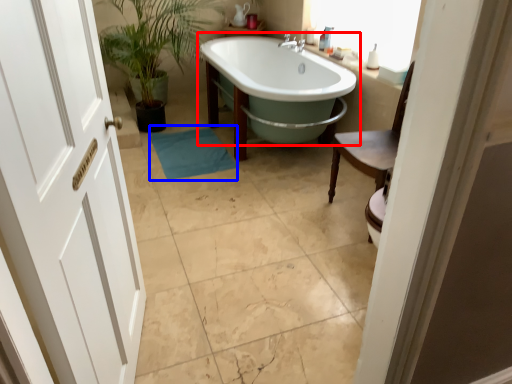
Question: Which object is closer to the camera taking this photo, bathtub (highlighted by a red box) or bath mat (highlighted by a blue box)?

Choices:
 (A) bathtub
 (B) bath mat

Answer: (A)